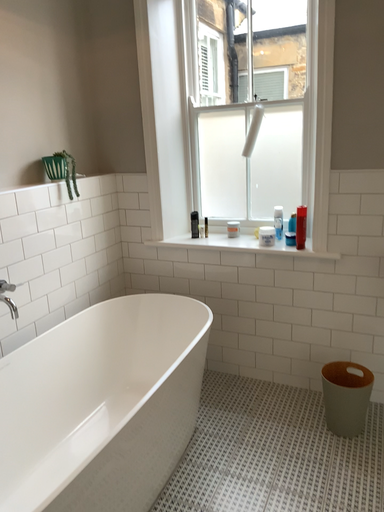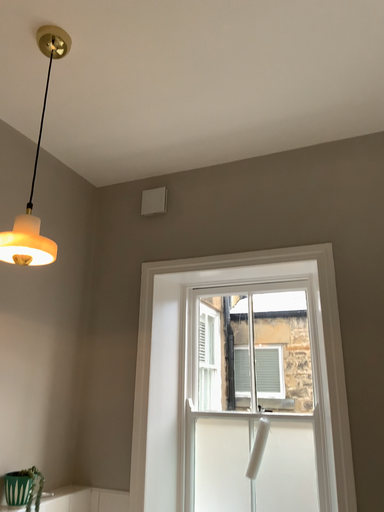
Question: Which way did the camera rotate in the video?

Choices:
 (A) rotated upward
 (B) rotated downward

Answer: (A)